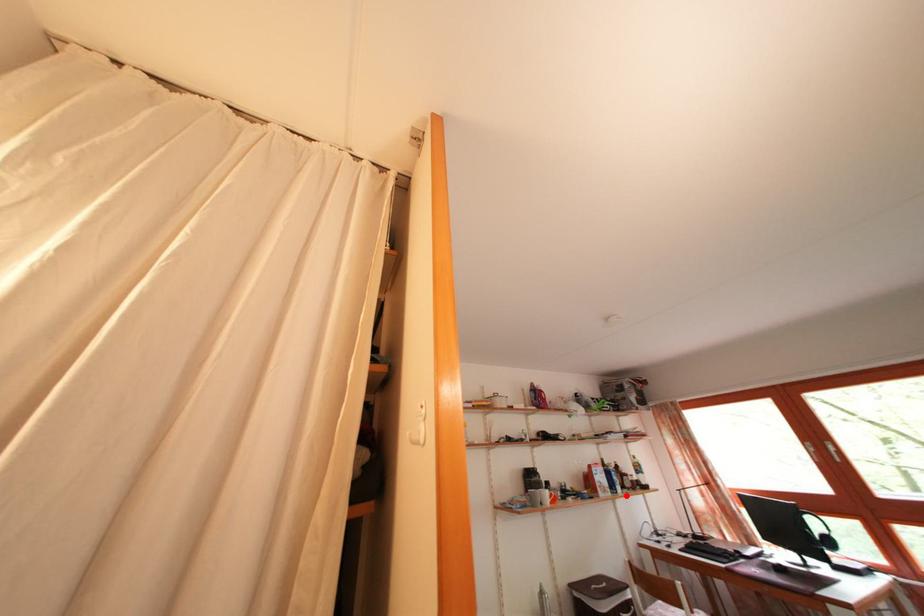
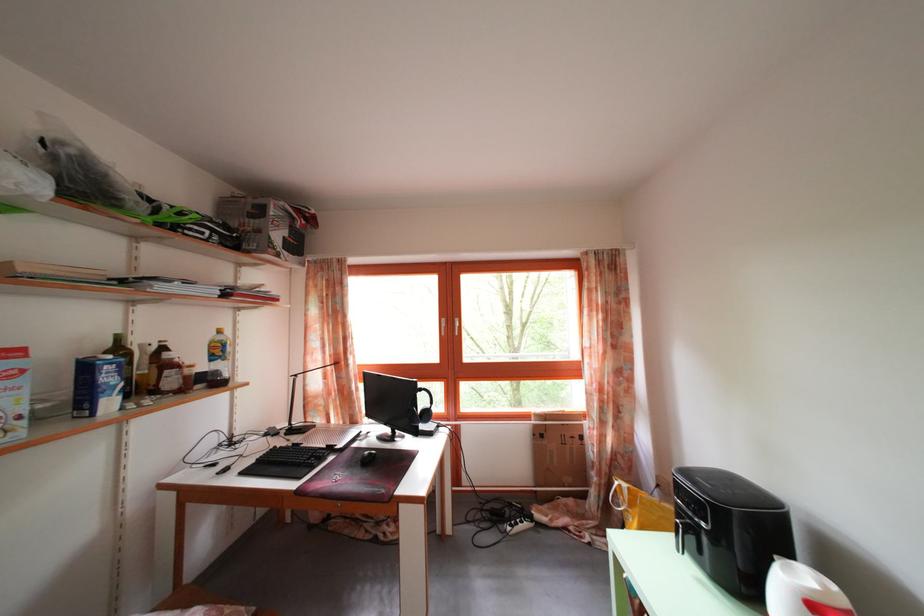
Question: I am providing you with two images of the same scene from different viewpoints. A red point is shown in image1. For the corresponding object point in image2, is it positioned nearer or farther from the camera?

Choices:
 (A) Nearer
 (B) Farther

Answer: (A)